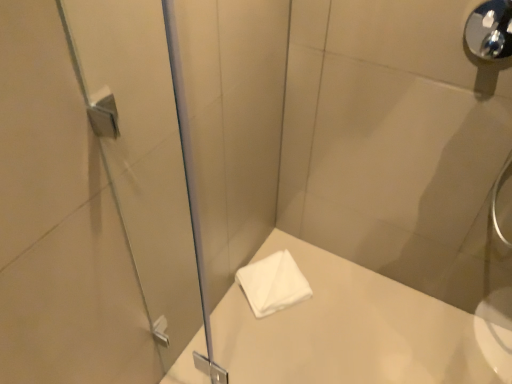
Question: Should I look upward or downward to see white soft towel at center?

Choices:
 (A) up
 (B) down

Answer: (B)

Question: From the image's perspective, would you say polished chrome shower handle at upper right is positioned over white soft towel at center?

Choices:
 (A) yes
 (B) no

Answer: (A)

Question: Is polished chrome shower handle at upper right positioned behind white soft towel at center?

Choices:
 (A) yes
 (B) no

Answer: (B)

Question: From the image's perspective, does polished chrome shower handle at upper right appear lower than white soft towel at center?

Choices:
 (A) yes
 (B) no

Answer: (B)

Question: Is polished chrome shower handle at upper right aimed at white soft towel at center?

Choices:
 (A) yes
 (B) no

Answer: (B)

Question: Is polished chrome shower handle at upper right taller than white soft towel at center?

Choices:
 (A) yes
 (B) no

Answer: (A)

Question: Is polished chrome shower handle at upper right far from white soft towel at center?

Choices:
 (A) no
 (B) yes

Answer: (B)

Question: Is white soft towel at center aimed at polished chrome shower handle at upper right?

Choices:
 (A) no
 (B) yes

Answer: (A)

Question: Is polished chrome shower handle at upper right surrounded by white soft towel at center?

Choices:
 (A) yes
 (B) no

Answer: (B)

Question: Is white soft towel at center smaller than polished chrome shower handle at upper right?

Choices:
 (A) yes
 (B) no

Answer: (B)

Question: Can you confirm if white soft towel at center is taller than polished chrome shower handle at upper right?

Choices:
 (A) no
 (B) yes

Answer: (A)

Question: Does white soft towel at center have a lesser height compared to polished chrome shower handle at upper right?

Choices:
 (A) yes
 (B) no

Answer: (A)

Question: Is white soft towel at center to the left of polished chrome shower handle at upper right from the viewer's perspective?

Choices:
 (A) no
 (B) yes

Answer: (B)

Question: Can you confirm if white soft towel at center is thinner than transparent glass screen door at left?

Choices:
 (A) yes
 (B) no

Answer: (B)